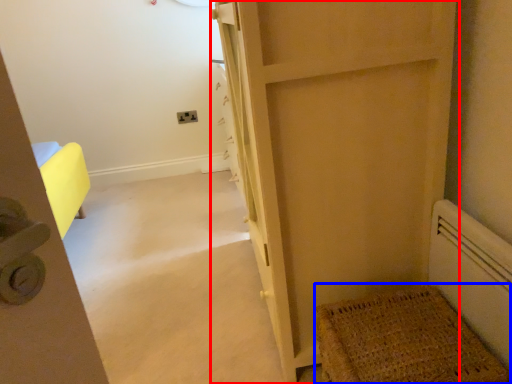
Question: Which object is closer to the camera taking this photo, door (highlighted by a red box) or doormat (highlighted by a blue box)?

Choices:
 (A) door
 (B) doormat

Answer: (A)